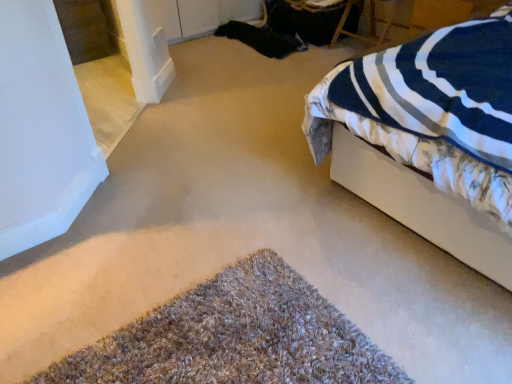
Identify the location of vacant region to the left of wooden chair at upper right. (320, 58).